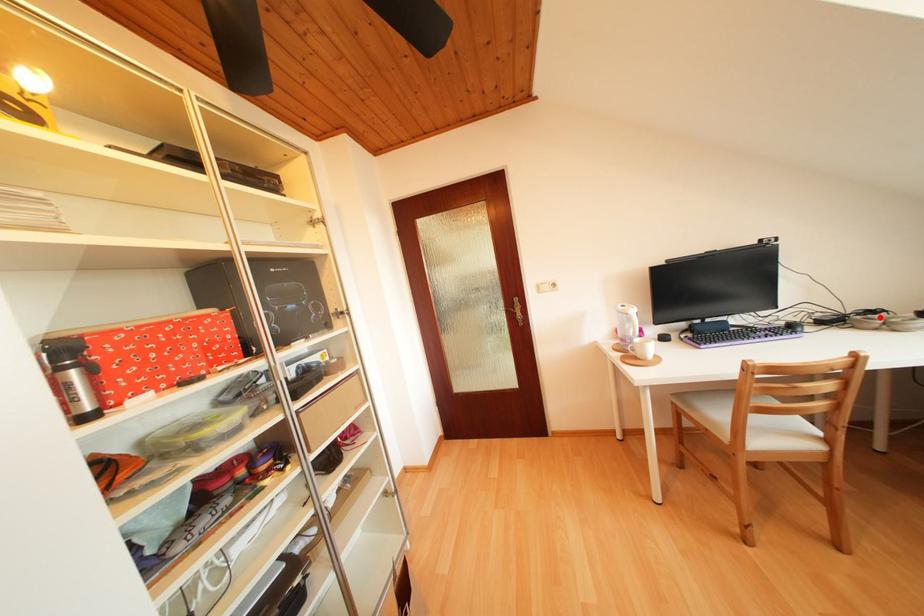
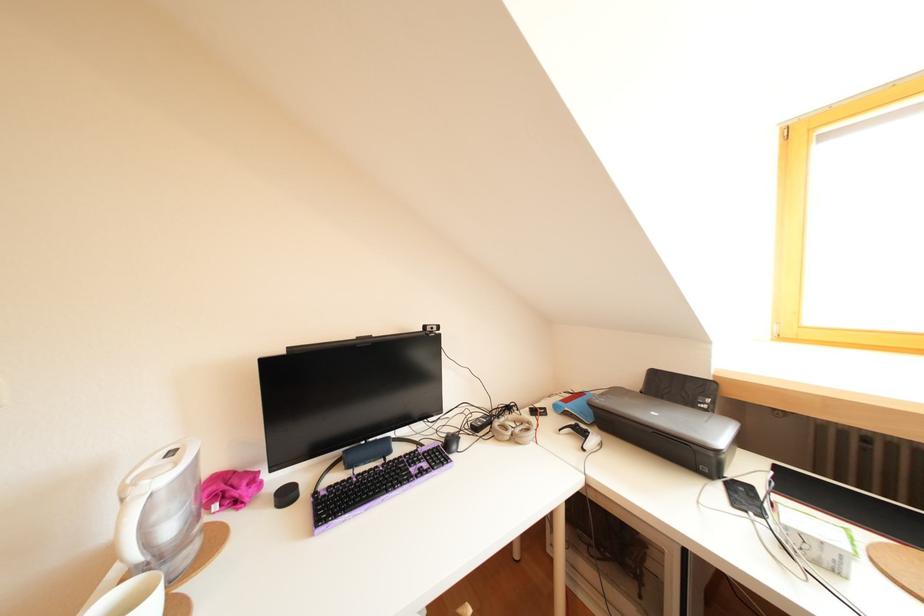
The point at the highlighted location is marked in the first image. Where is the corresponding point in the second image?

(516, 413)